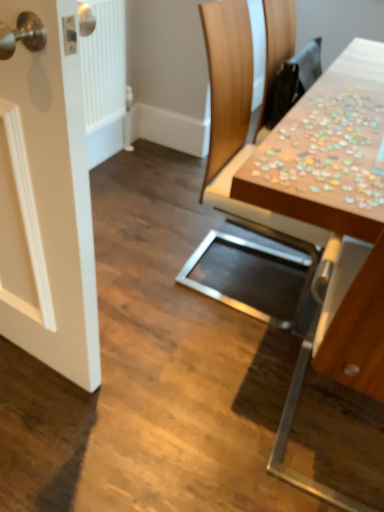
Question: From a real-world perspective, is wooden chair at upper right positioned under wooden puzzle pieces at upper right based on gravity?

Choices:
 (A) no
 (B) yes

Answer: (B)

Question: Is wooden chair at upper right wider than wooden puzzle pieces at upper right?

Choices:
 (A) yes
 (B) no

Answer: (B)

Question: Is wooden chair at upper right oriented towards wooden puzzle pieces at upper right?

Choices:
 (A) no
 (B) yes

Answer: (A)

Question: From the image's perspective, does wooden chair at upper right appear lower than wooden puzzle pieces at upper right?

Choices:
 (A) yes
 (B) no

Answer: (B)

Question: From the image's perspective, is wooden chair at upper right on top of wooden puzzle pieces at upper right?

Choices:
 (A) no
 (B) yes

Answer: (B)

Question: Would you say wooden chair at upper right is inside or outside wooden puzzle pieces at upper right?

Choices:
 (A) inside
 (B) outside

Answer: (B)

Question: Is wooden chair at upper right wider or thinner than wooden puzzle pieces at upper right?

Choices:
 (A) wide
 (B) thin

Answer: (A)

Question: Visually, is wooden chair at upper right positioned to the left or to the right of wooden puzzle pieces at upper right?

Choices:
 (A) left
 (B) right

Answer: (A)

Question: Considering the positions of wooden chair at upper right and wooden puzzle pieces at upper right in the image, is wooden chair at upper right taller or shorter than wooden puzzle pieces at upper right?

Choices:
 (A) tall
 (B) short

Answer: (A)

Question: In the image, is wooden puzzle pieces at upper right on the left side or the right side of wooden puzzle pieces at upper right?

Choices:
 (A) left
 (B) right

Answer: (A)

Question: Is wooden puzzle pieces at upper right taller or shorter than wooden puzzle pieces at upper right?

Choices:
 (A) short
 (B) tall

Answer: (B)

Question: Is wooden puzzle pieces at upper right wider or thinner than wooden puzzle pieces at upper right?

Choices:
 (A) thin
 (B) wide

Answer: (B)

Question: Looking at the image, does wooden puzzle pieces at upper right seem bigger or smaller compared to wooden puzzle pieces at upper right?

Choices:
 (A) big
 (B) small

Answer: (A)

Question: Is wooden puzzle pieces at upper right situated inside wooden puzzle pieces at upper right or outside?

Choices:
 (A) outside
 (B) inside

Answer: (A)

Question: Is wooden puzzle pieces at upper right taller or shorter than wooden puzzle pieces at upper right?

Choices:
 (A) tall
 (B) short

Answer: (B)